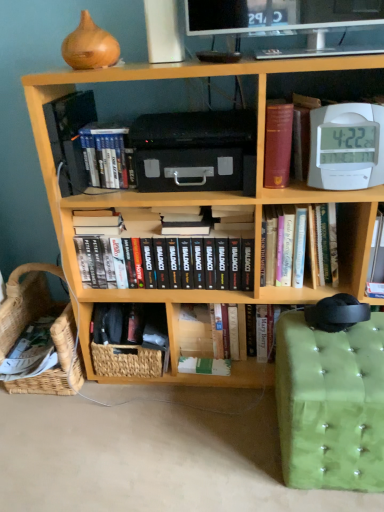
Identify the location of free spot above woven basket at lower left, the second basket viewed from the left (from a real-world perspective). (137, 328).